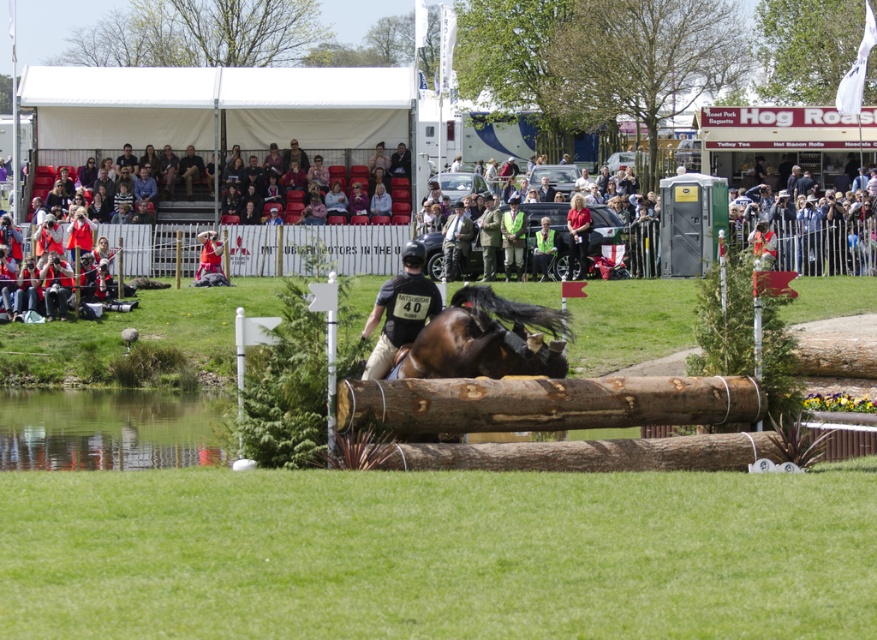
Question: Estimate the real-world distances between objects in this image. Which object is farther from the natural wood log at center?

Choices:
 (A) black matte shirt at center
 (B) brown glossy horse at center

Answer: (A)

Question: Is natural wood log at center positioned before black matte shirt at center?

Choices:
 (A) yes
 (B) no

Answer: (A)

Question: Which point is farther from the camera taking this photo?

Choices:
 (A) (412, 264)
 (B) (412, 419)

Answer: (A)

Question: Considering the relative positions of brown glossy horse at center and black matte shirt at center in the image provided, where is brown glossy horse at center located with respect to black matte shirt at center?

Choices:
 (A) left
 (B) right

Answer: (B)

Question: Which object is farther from the camera taking this photo?

Choices:
 (A) natural wood log at center
 (B) brown glossy horse at center

Answer: (B)

Question: Does brown glossy horse at center have a smaller size compared to black matte shirt at center?

Choices:
 (A) no
 (B) yes

Answer: (B)